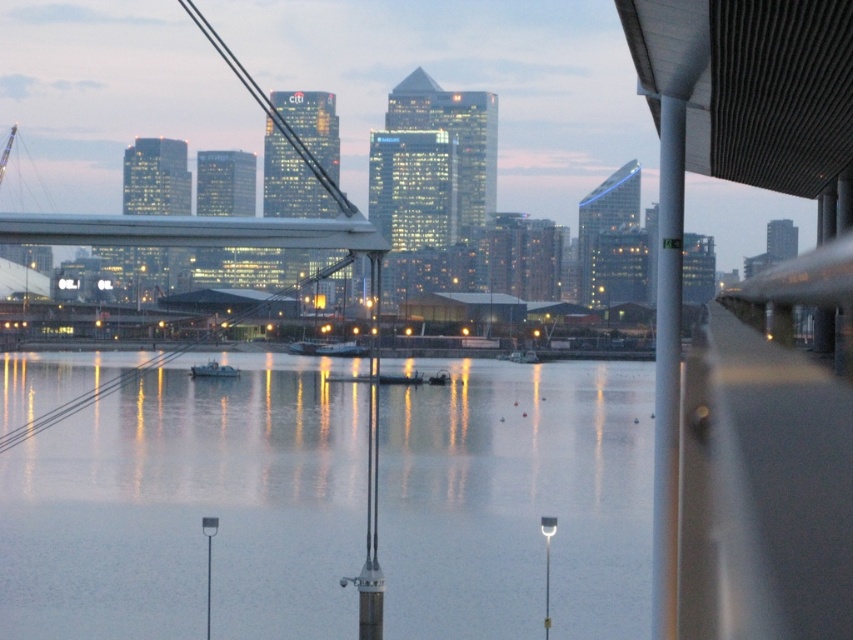
You are a GUI agent. You are given a task and a screenshot of the screen. Output one action in this format:
    pyautogui.click(x=<x>, y=<y>)
    Task: Click on the smooth water at center
    The image size is (853, 640).
    Given the screenshot: What is the action you would take?
    pyautogui.click(x=189, y=509)

Describe the element at coordinates (189, 509) in the screenshot. I see `smooth water at center` at that location.

At what (x,y) coordinates should I click in order to perform the action: click on smooth water at center. Please return your answer as a coordinate pair (x, y). Image resolution: width=853 pixels, height=640 pixels. Looking at the image, I should click on (189, 509).